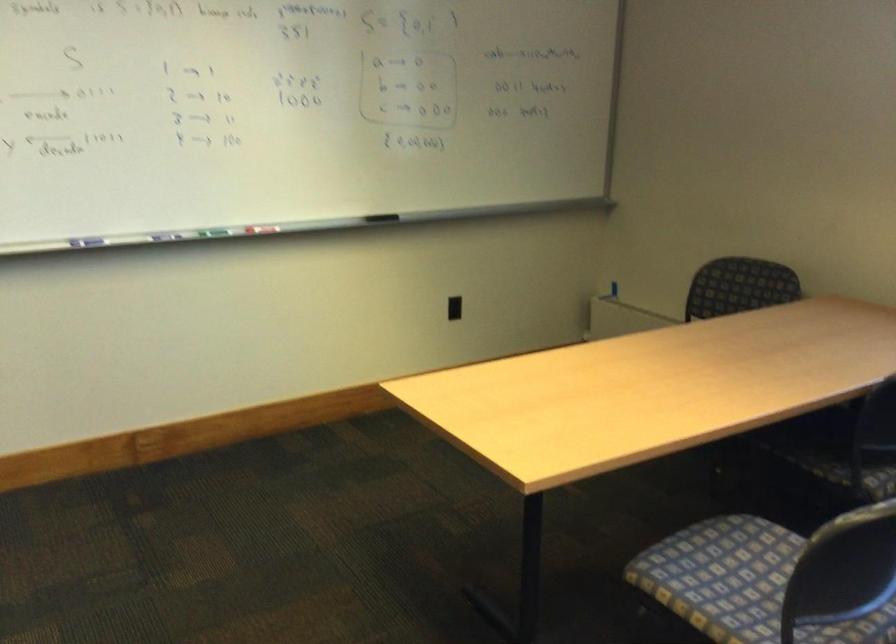
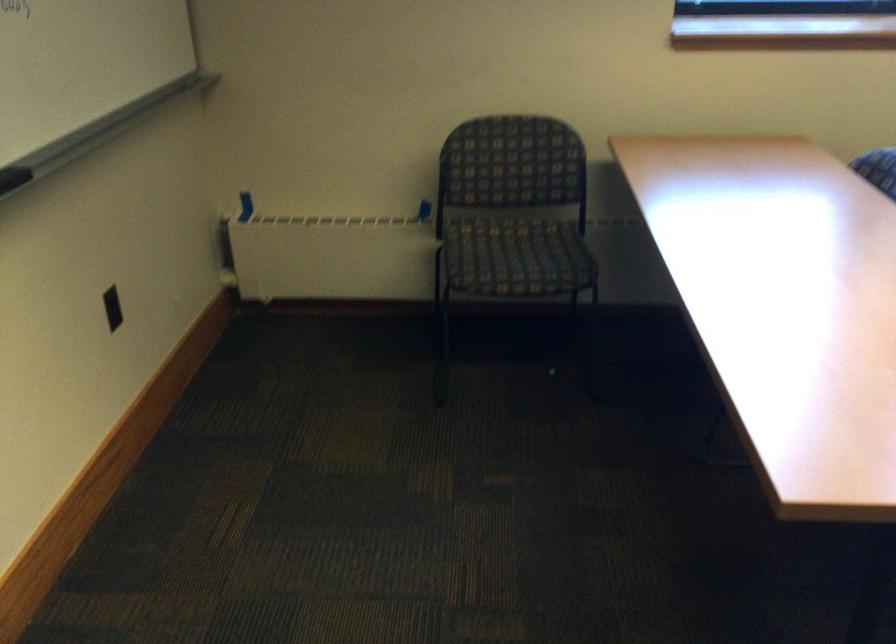
Locate, in the second image, the point that corresponds to (x=369, y=207) in the first image.

(13, 178)